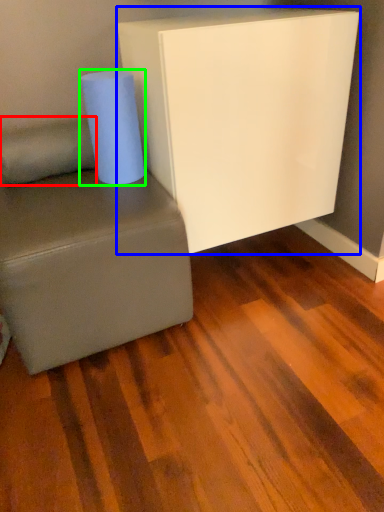
Question: Which object is positioned closest to pillow (highlighted by a red box)? Select from furniture (highlighted by a blue box) and paper towel (highlighted by a green box).

Choices:
 (A) furniture
 (B) paper towel

Answer: (B)